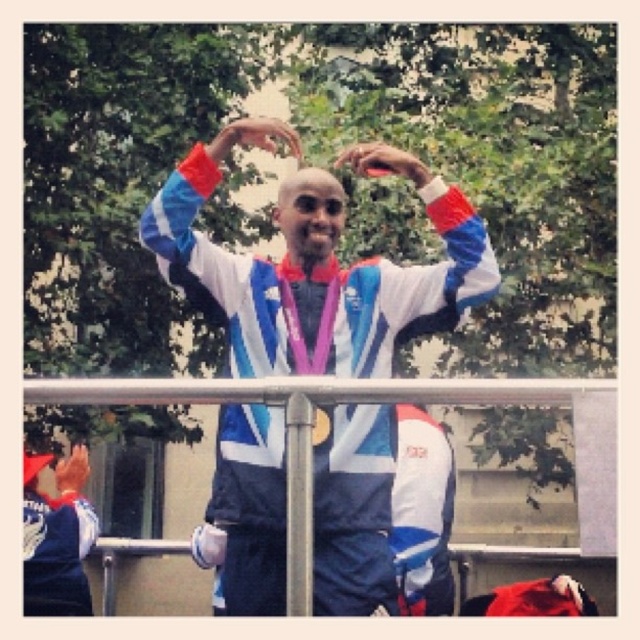
Question: Which of the following is the closest to the observer?

Choices:
 (A) (321, 260)
 (B) (346, 493)
 (C) (83, 547)
 (D) (499, 394)

Answer: (D)

Question: Is metallic silver rail at center wider than matte purple medal at center?

Choices:
 (A) no
 (B) yes

Answer: (B)

Question: Among these objects, which one is farthest from the camera?

Choices:
 (A) matte black hand at lower left
 (B) blue/white/red fabric at center
 (C) blue fabric jacket at left

Answer: (A)

Question: Can you confirm if blue/white/red fabric at center is wider than metallic silver rail at center?

Choices:
 (A) no
 (B) yes

Answer: (A)

Question: Observing the image, what is the correct spatial positioning of blue/white/red fabric at center in reference to blue fabric jacket at left?

Choices:
 (A) below
 (B) above

Answer: (B)

Question: Considering the real-world distances, which object is closest to the blue fabric jacket at left?

Choices:
 (A) metallic silver rail at center
 (B) blue/white/red fabric at center

Answer: (B)